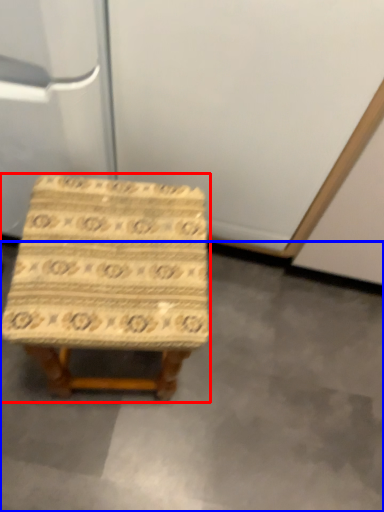
Question: Among these objects, which one is nearest to the camera, stool (highlighted by a red box) or concrete (highlighted by a blue box)?

Choices:
 (A) stool
 (B) concrete

Answer: (A)